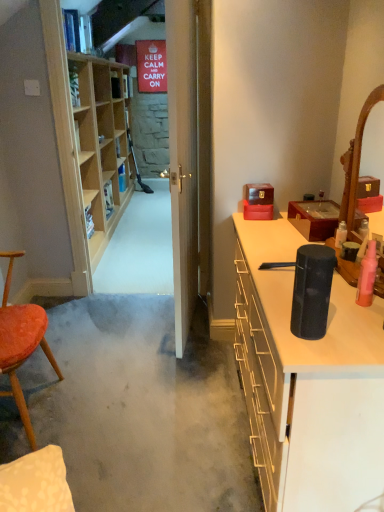
Identify the location of vacant area to the left of wooden jewelry box at upper right, which appears as the first cabinetry when viewed from the top. The height and width of the screenshot is (512, 384). (276, 233).